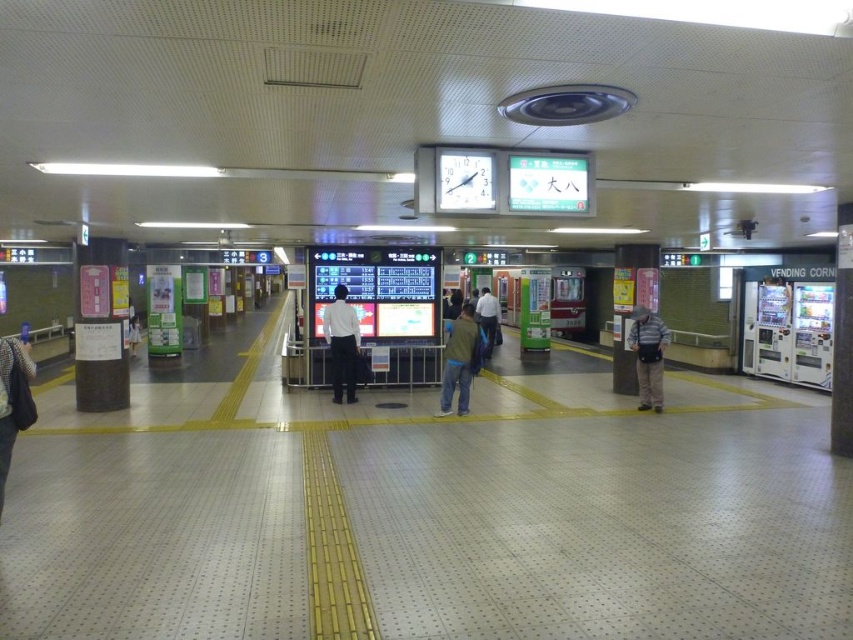
Where is `white shirt at center`? white shirt at center is located at coordinates coord(341,344).

Which of these two, white shirt at center or blue jeans at center, stands shorter?

Standing shorter between the two is white shirt at center.

You are a GUI agent. You are given a task and a screenshot of the screen. Output one action in this format:
    pyautogui.click(x=<x>, y=<y>)
    Task: Click on the white shirt at center
    
    Given the screenshot: What is the action you would take?
    pyautogui.click(x=341, y=344)

Is denim jacket at lower left closer to camera compared to striped cotton shirt at center?

Yes, it is in front of striped cotton shirt at center.

Who is positioned more to the right, denim jacket at lower left or striped cotton shirt at center?

From the viewer's perspective, striped cotton shirt at center appears more on the right side.

Is point (19, 365) farther from camera compared to point (637, 404)?

That is False.

Find the location of a particular element. denim jacket at lower left is located at coordinates (13, 401).

How much distance is there between denim jacket at lower left and white shirt at center?

denim jacket at lower left and white shirt at center are 19.67 feet apart.

The width and height of the screenshot is (853, 640). Describe the element at coordinates (13, 401) in the screenshot. I see `denim jacket at lower left` at that location.

I want to click on denim jacket at lower left, so click(13, 401).